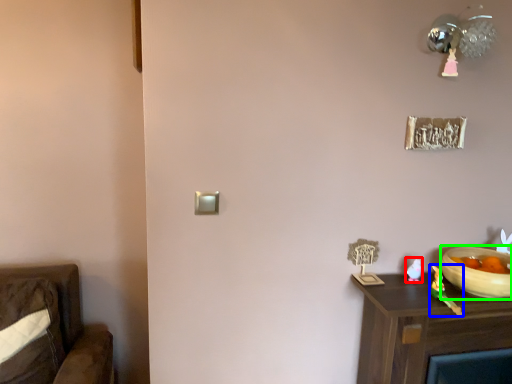
Question: Considering the real-world distances, which object is closest to toy (highlighted by a red box)? toy (highlighted by a blue box) or bowl (highlighted by a green box).

Choices:
 (A) toy
 (B) bowl

Answer: (A)